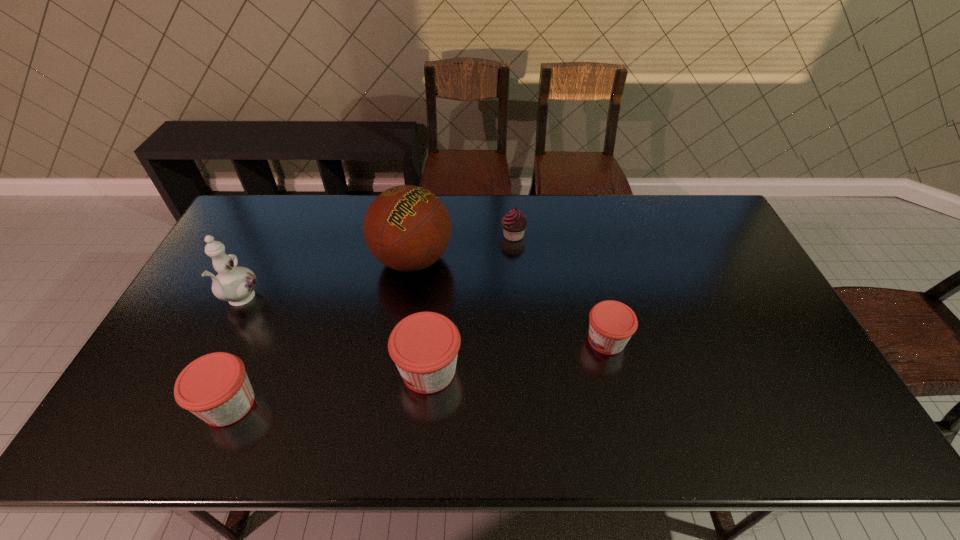
All jams are currently evenly spaced. To continue this pattern, where would you add another jam on the right? Please point out a vacant spot. Please provide its 2D coordinates. Your answer should be formatted as a tuple, i.e. [(x, y)], where the tuple contains the x and y coordinates of a point satisfying the conditions above.

[(766, 313)]